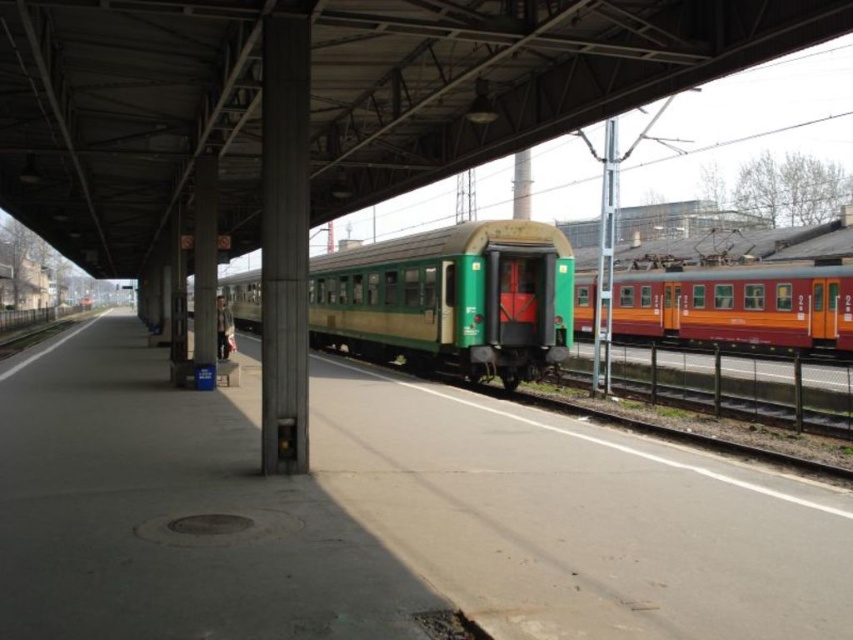
You are standing on the train station platform and see the green matte train at center. Where is the point at coordinates (x=450, y=300) located in relation to the green matte train at center?

The point at coordinates (x=450, y=300) corresponds to the green matte train at center.

You are standing on the train station platform and want to take a photo that includes both point (402, 248) and point (573, 330). Since you want to ensure both points are in focus, which point should you focus on to maximize the chances of both being sharp?

You should focus on point (402, 248) because it is closer to the camera, and focusing on the closer object will ensure the farther point (573, 330) is within the depth of field.

You are standing on the platform and want to board the nearest train. Which train should you approach, the green matte train at center or the matte orange train at right?

The green matte train at center is closer to the viewer, so you should approach the green matte train at center first.